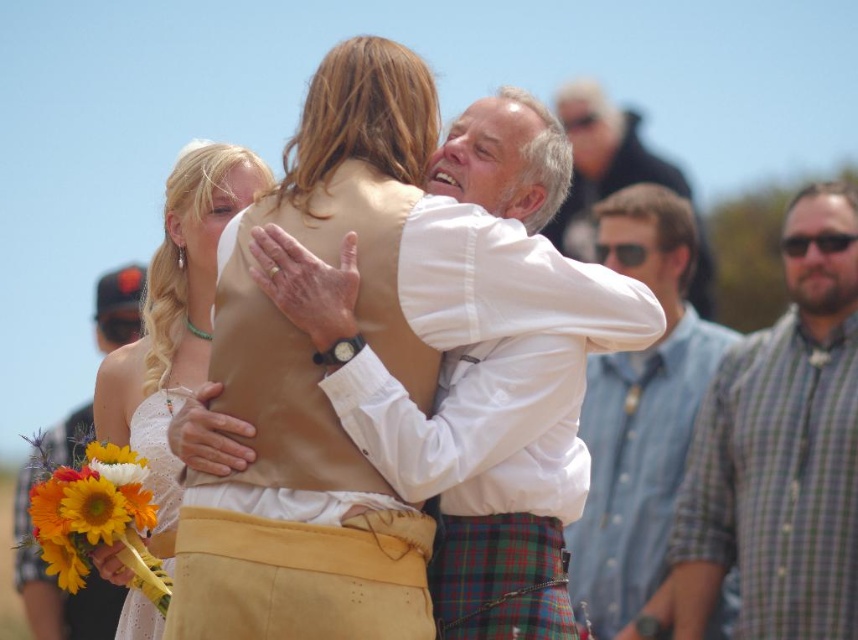
Question: Can you confirm if white lace dress at center is positioned above plaid fabric kilt at center?

Choices:
 (A) no
 (B) yes

Answer: (B)

Question: Among these objects, which one is nearest to the camera?

Choices:
 (A) white lace dress at center
 (B) checkered shirt at right
 (C) plaid wool kilt at center

Answer: (C)

Question: Can you confirm if matte khaki vest at center is bigger than vibrant sunflower bouquet at lower left?

Choices:
 (A) yes
 (B) no

Answer: (A)

Question: Which of the following is the farthest from the observer?

Choices:
 (A) (608, 179)
 (B) (518, 602)
 (C) (82, 508)

Answer: (A)

Question: Which of the following is the farthest from the observer?

Choices:
 (A) (621, 157)
 (B) (94, 481)

Answer: (A)

Question: Is denim shirt at right closer to the viewer compared to sunflower bouquet at lower left?

Choices:
 (A) yes
 (B) no

Answer: (B)